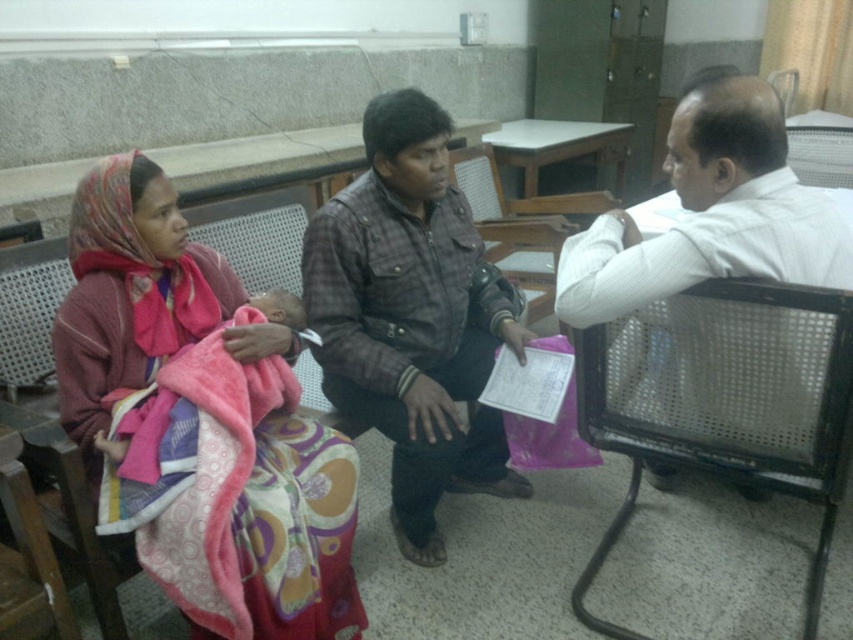
Is plaid fabric shirt at center wider than wooden mesh chair at center?

In fact, plaid fabric shirt at center might be narrower than wooden mesh chair at center.

The image size is (853, 640). In order to click on plaid fabric shirt at center in this screenshot , I will do `click(412, 317)`.

Where is `plaid fabric shirt at center`? Image resolution: width=853 pixels, height=640 pixels. plaid fabric shirt at center is located at coordinates (412, 317).

Who is positioned more to the left, wooden mesh chair at center or pink soft blanket at center?

Positioned to the left is pink soft blanket at center.

From the picture: Which of these two, wooden mesh chair at center or pink soft blanket at center, stands shorter?

pink soft blanket at center

Does point (497, 186) come farther from viewer compared to point (251, 340)?

Yes, point (497, 186) is farther from viewer.

Find the location of a particular element. wooden mesh chair at center is located at coordinates (521, 225).

Is metal mesh chair at right thinner than white shirt at right?

Yes, metal mesh chair at right is thinner than white shirt at right.

Can you confirm if metal mesh chair at right is taller than white shirt at right?

In fact, metal mesh chair at right may be shorter than white shirt at right.

In order to click on metal mesh chair at right in this screenshot , I will do `click(724, 401)`.